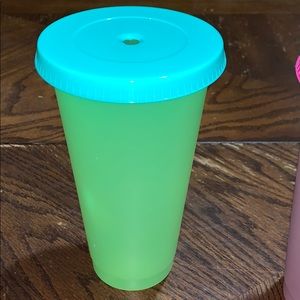
Identify the location of green cup. (151, 136).